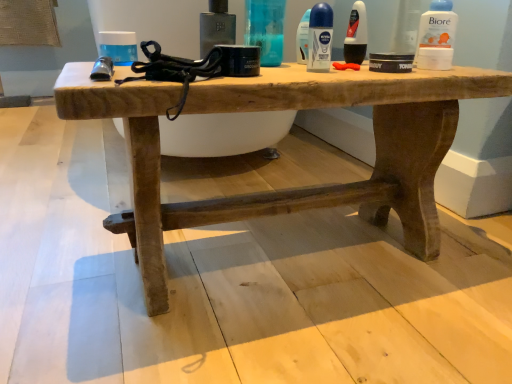
Locate an element on the screen. This screenshot has height=384, width=512. free space in front of blue matte deodorant at upper center, which is the 3th mouthwash from front to back is located at coordinates (323, 70).